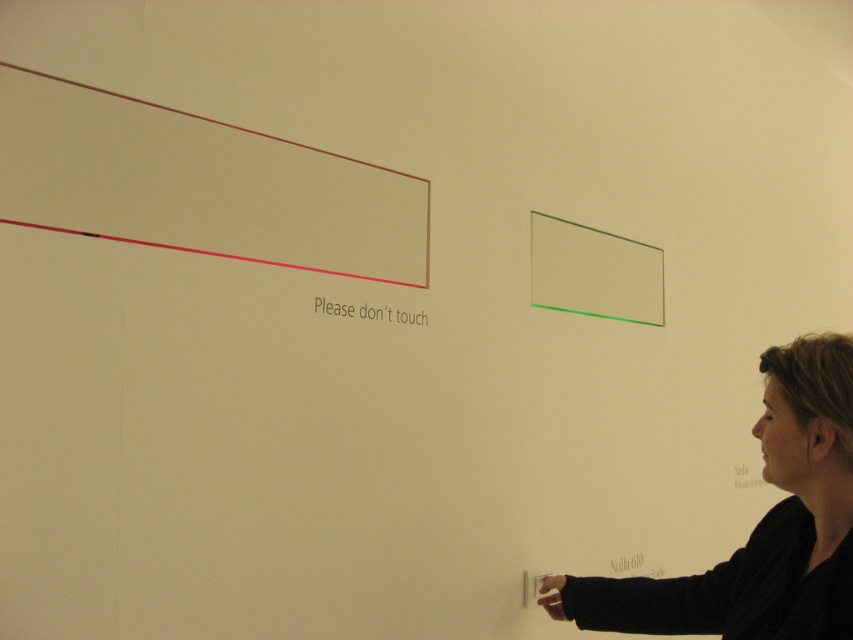
Question: Is green matte rectangle at upper right above white paper at upper center?

Choices:
 (A) yes
 (B) no

Answer: (A)

Question: Which of these objects is positioned closest to the matte brown rectangle at upper left?

Choices:
 (A) white paper at upper center
 (B) dark brown hair at lower right
 (C) green matte rectangle at upper right

Answer: (A)

Question: Which object is positioned closest to the green matte rectangle at upper right?

Choices:
 (A) dark brown hair at lower right
 (B) white paper at upper center
 (C) matte brown rectangle at upper left

Answer: (B)

Question: Which is nearer to the dark brown hair at lower right?

Choices:
 (A) matte brown rectangle at upper left
 (B) white paper at upper center

Answer: (B)

Question: Is dark brown hair at lower right closer to camera compared to white paper at upper center?

Choices:
 (A) yes
 (B) no

Answer: (A)

Question: Can you confirm if matte brown rectangle at upper left is positioned to the right of dark brown hair at lower right?

Choices:
 (A) yes
 (B) no

Answer: (B)